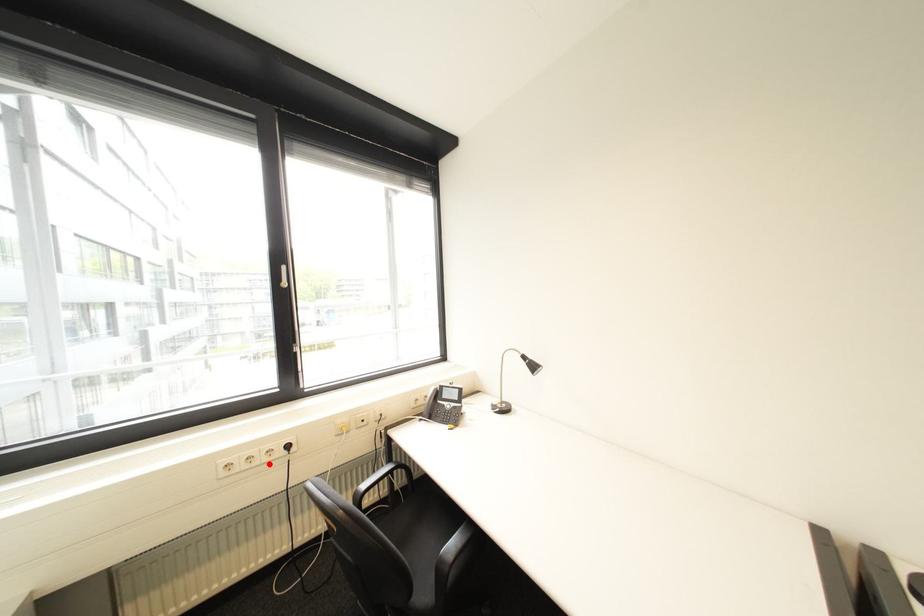
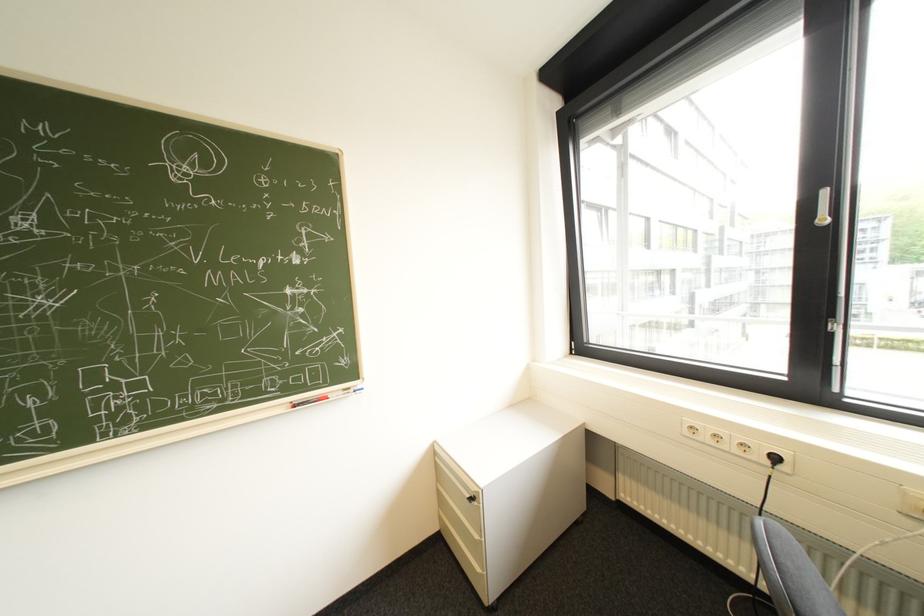
In the second image, find the point that corresponds to the highlighted location in the first image.

(737, 450)